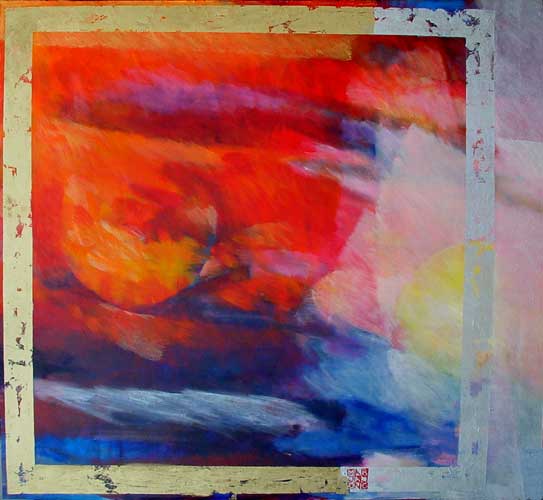
This screenshot has width=543, height=500. Identify the location of painting. (103, 186).